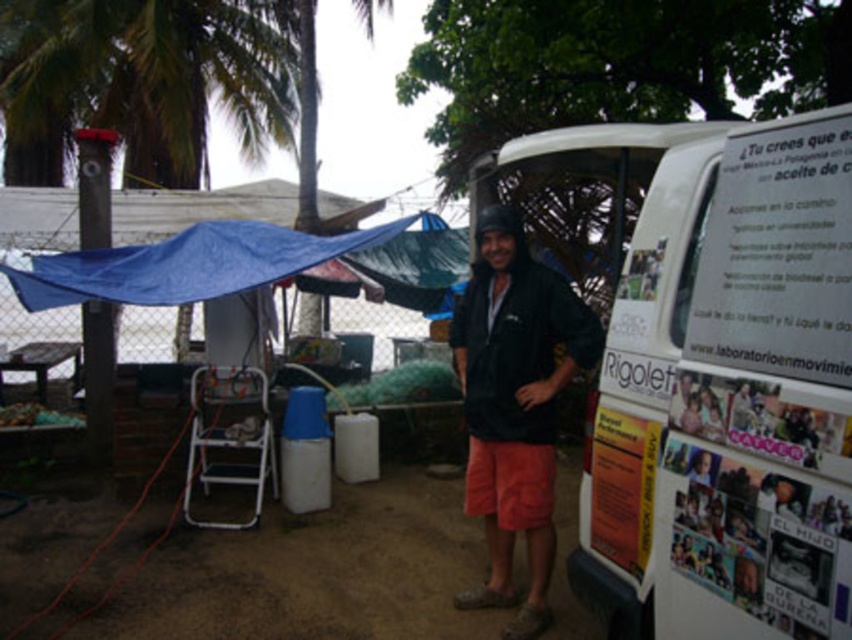
You are standing in the tropical outdoor area and see the white glossy van at center and the black matte jacket at center. Which object is positioned to the right of the other?

The white glossy van at center is to the right of the black matte jacket at center.

You are standing in the tropical outdoor scene described. You want to move from your current position to the white glossy van at center. Is the distance between you and the van sufficient to allow you to walk directly to it without needing to move any objects?

The distance between you and the white glossy van at center is 1.84 meters, which is enough space to walk directly to it without needing to move any objects.